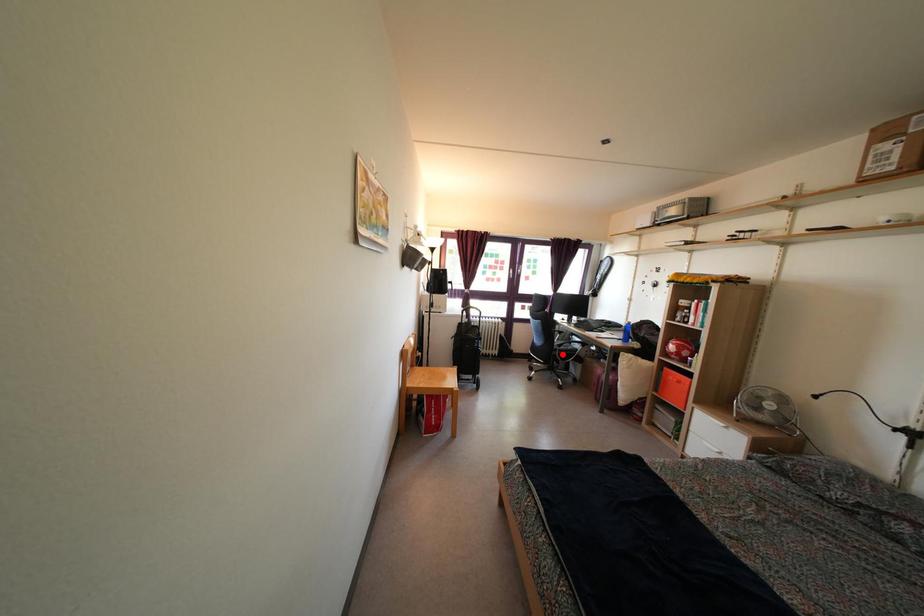
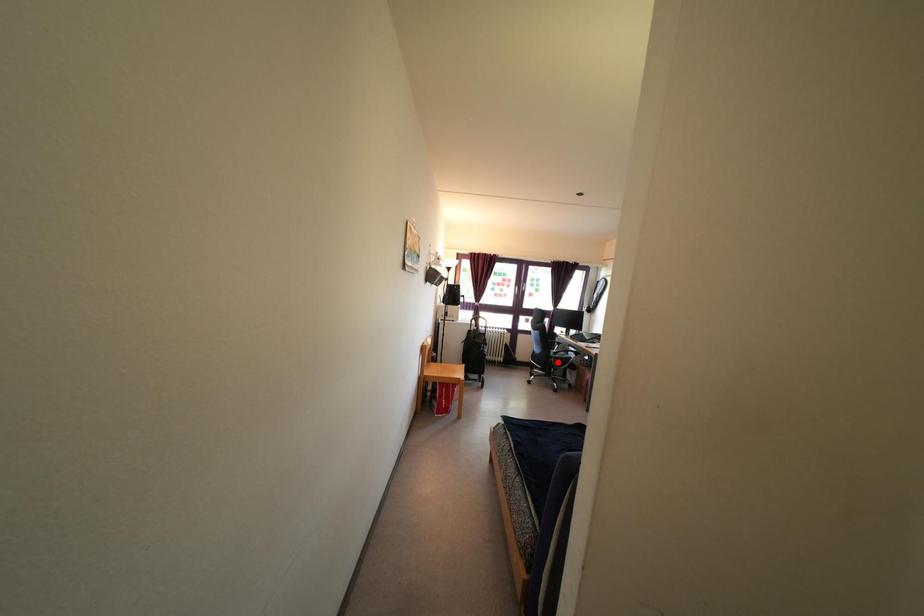
I am providing you with two images of the same scene from different viewpoints. A red point is marked on the first image and another point is marked on the second image. Does the point marked in image1 correspond to the same location as the one in image2?

Yes